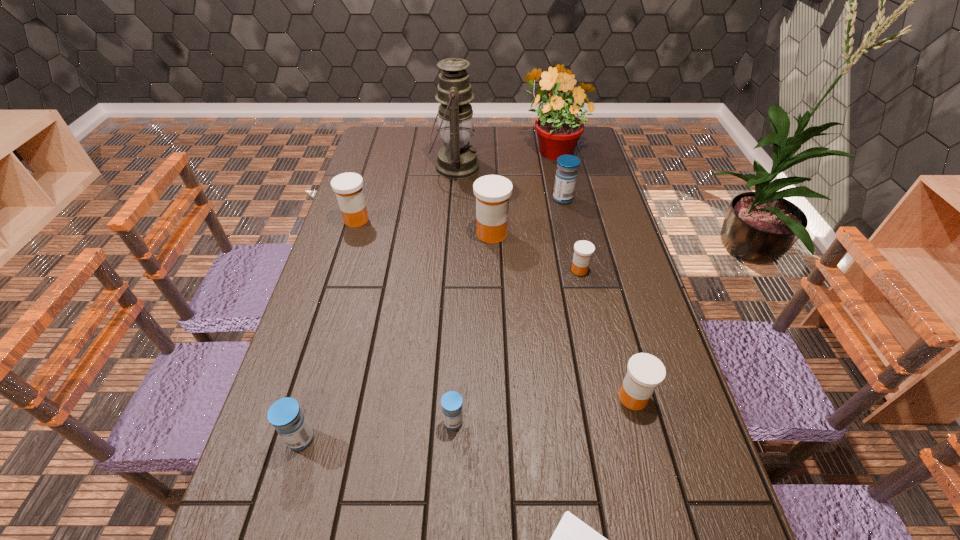
At what (x,y) coordinates should I click in order to perform the action: click on oil lamp. Please return your answer as a coordinate pair (x, y). The height and width of the screenshot is (540, 960). Looking at the image, I should click on (456, 160).

This screenshot has height=540, width=960. I want to click on flowerpot, so click(558, 129).

Find the location of a particular element. The height and width of the screenshot is (540, 960). the ninth shortest object is located at coordinates (558, 129).

Identify the location of the fourth medicine from right to left. The width and height of the screenshot is (960, 540). (492, 192).

You are a GUI agent. You are given a task and a screenshot of the screen. Output one action in this format:
    pyautogui.click(x=<x>, y=<y>)
    Task: Click on the tallest medicine
    This screenshot has height=540, width=960.
    Given the screenshot: What is the action you would take?
    pyautogui.click(x=492, y=192)

Locate an element on the screen. the leftmost orange medicine is located at coordinates pyautogui.click(x=348, y=186).

The width and height of the screenshot is (960, 540). I want to click on the third farthest object, so click(566, 175).

Where is `the farthest medicine`? The height and width of the screenshot is (540, 960). the farthest medicine is located at coordinates (566, 175).

Identify the location of the nearest orange medicine. This screenshot has height=540, width=960. point(645,372).

Find the location of `the second smallest blue medicine`. the second smallest blue medicine is located at coordinates (285, 415).